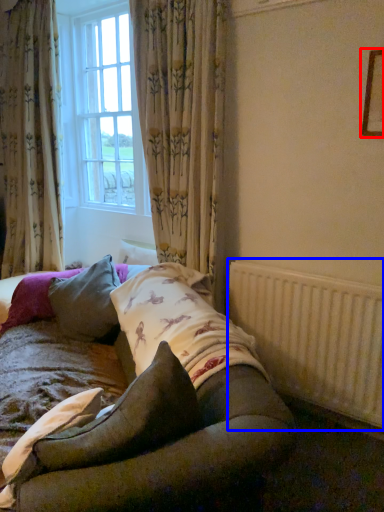
Question: Which object is closer to the camera taking this photo, picture frame (highlighted by a red box) or radiator (highlighted by a blue box)?

Choices:
 (A) picture frame
 (B) radiator

Answer: (A)